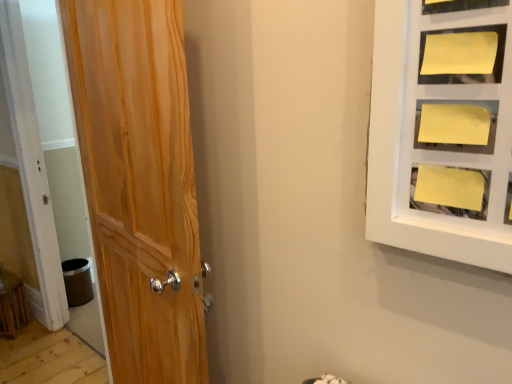
The height and width of the screenshot is (384, 512). Describe the element at coordinates (139, 183) in the screenshot. I see `natural wood door at left` at that location.

Locate an element on the screen. natural wood door at left is located at coordinates (139, 183).

Locate an element on the screen. natural wood door at left is located at coordinates (139, 183).